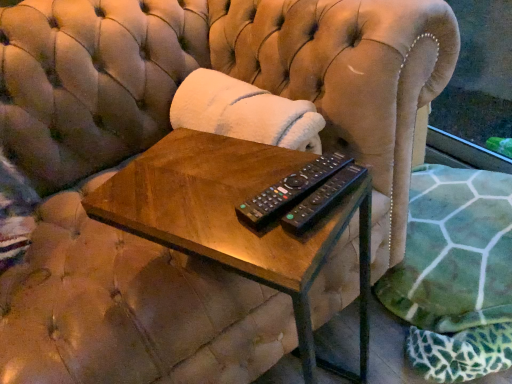
Identify the location of free point to the left of black plastic remote at center, the first remote control positioned from the front. (222, 211).